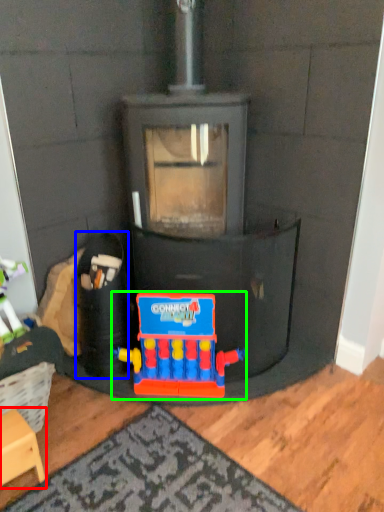
Question: Considering the real-world distances, which object is farthest from furniture (highlighted by a red box)? toy (highlighted by a blue box) or toy (highlighted by a green box)?

Choices:
 (A) toy
 (B) toy

Answer: (B)